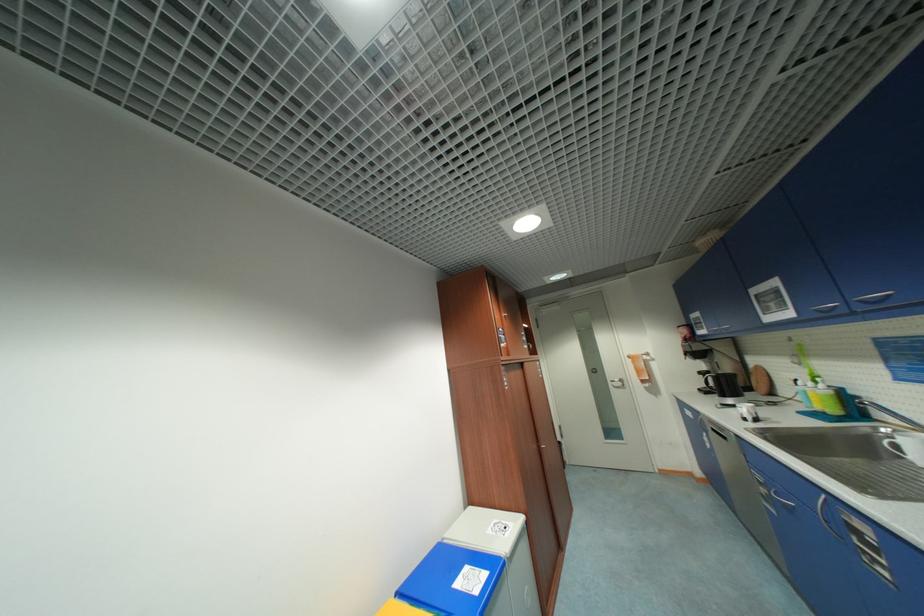
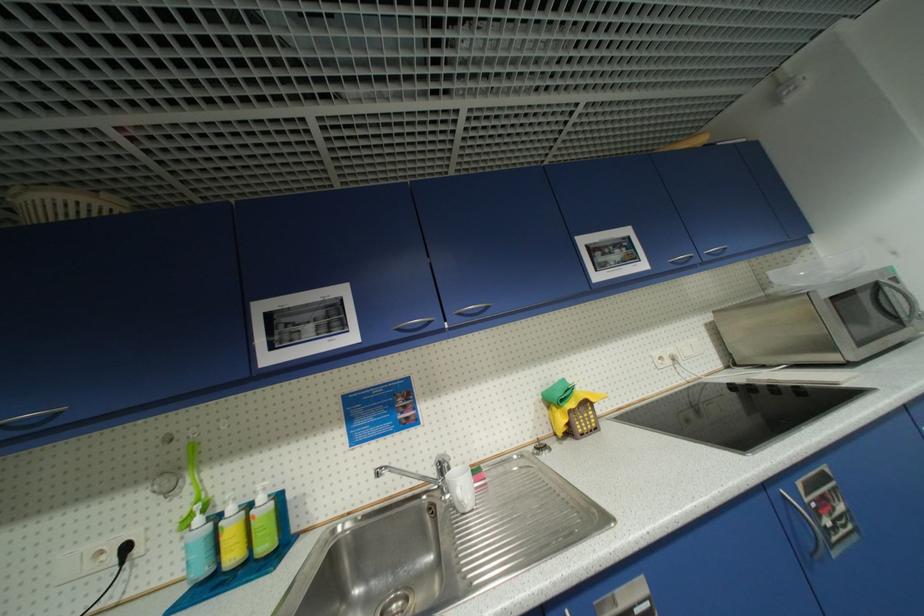
The point at (822, 312) is marked in the first image. Where is the corresponding point in the second image?

(405, 331)